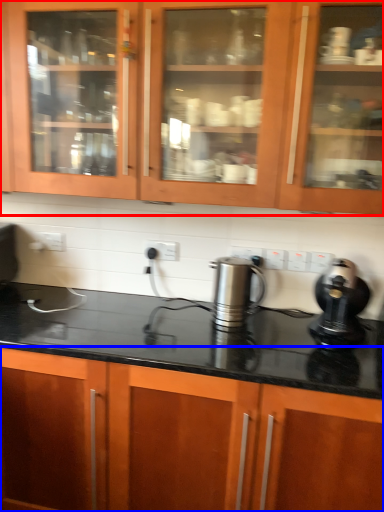
Question: Among these objects, which one is farthest to the camera, cabinetry (highlighted by a red box) or cabinetry (highlighted by a blue box)?

Choices:
 (A) cabinetry
 (B) cabinetry

Answer: (A)